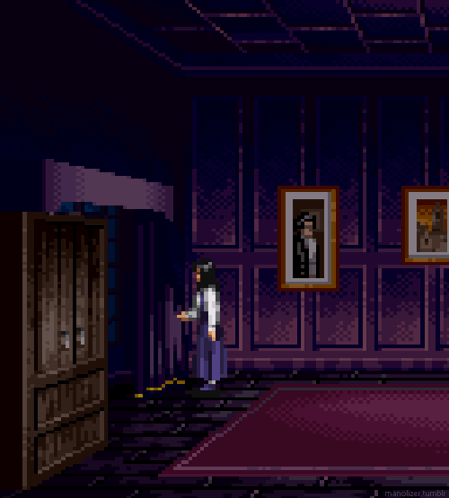
Find the location of a particular element. The width and height of the screenshot is (449, 498). wooden door is located at coordinates (88, 324), (48, 327).